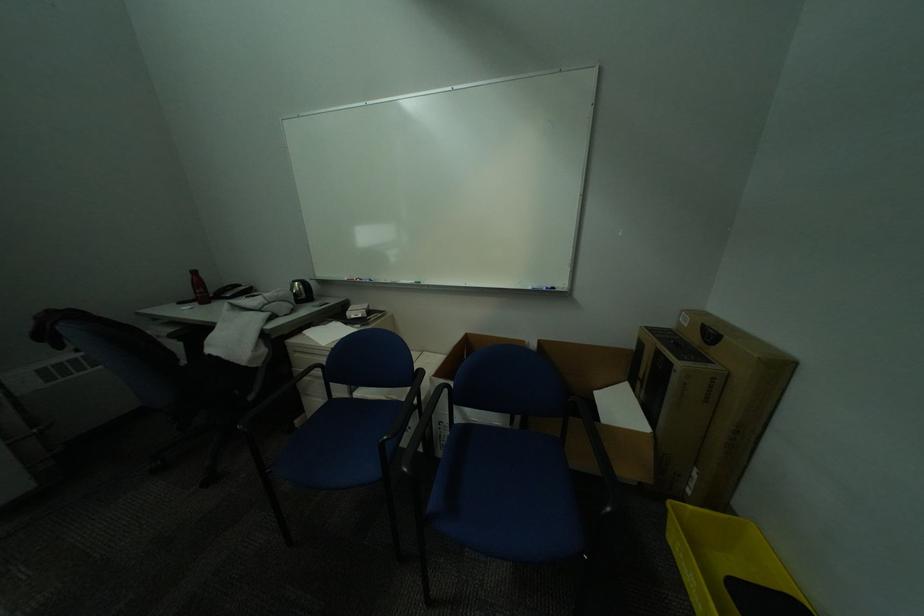
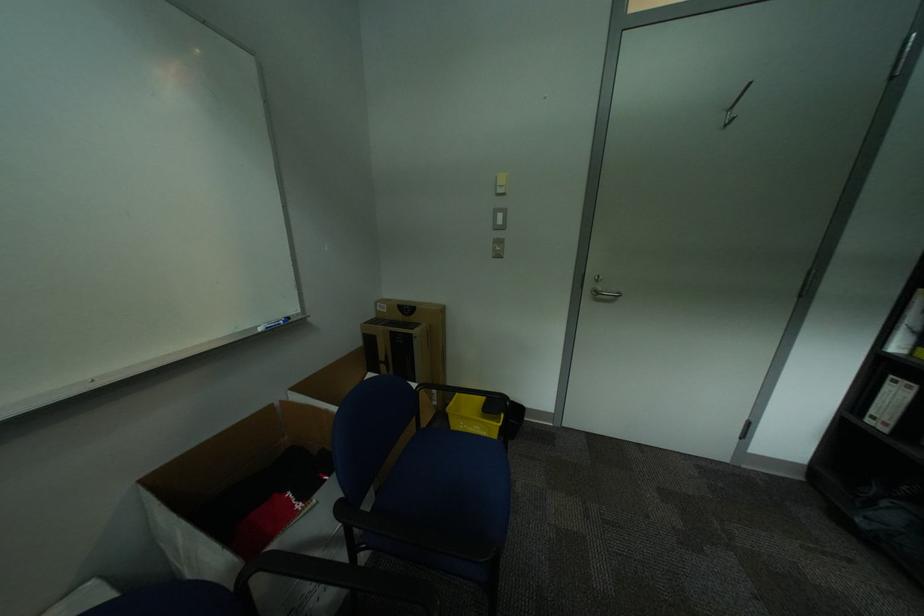
Question: The first image is from the beginning of the video and the second image is from the end. How did the camera likely rotate when shooting the video?

Choices:
 (A) Left
 (B) Right
 (C) Up
 (D) Down

Answer: (B)